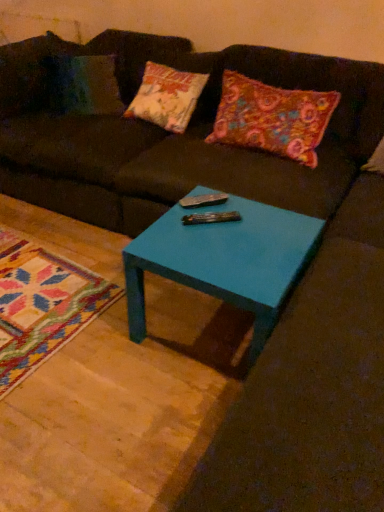
Find the location of a particular element. The height and width of the screenshot is (512, 384). vacant area located to the right-hand side of metallic silver remote at center is located at coordinates (250, 225).